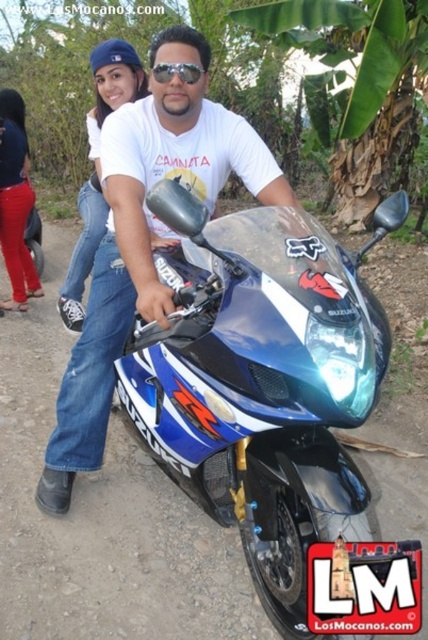
You are a photographer standing at the camera position. You want to place a small flag at a point that is exactly 10 feet away from the camera. Is the point at coordinates point (112, 93) suitable for placing the flag?

The distance of point (112, 93) from the camera is 11.33 feet, which is further than the desired 10 feet. Therefore, the point at coordinates point (112, 93) is not suitable for placing the flag.

You are a photographer trying to capture the best angle of the scene. You notice a specific point at coordinates point (98, 164). Which object in the scene is this point located on?

The point (98, 164) is located on the matte white t shirt at upper center.